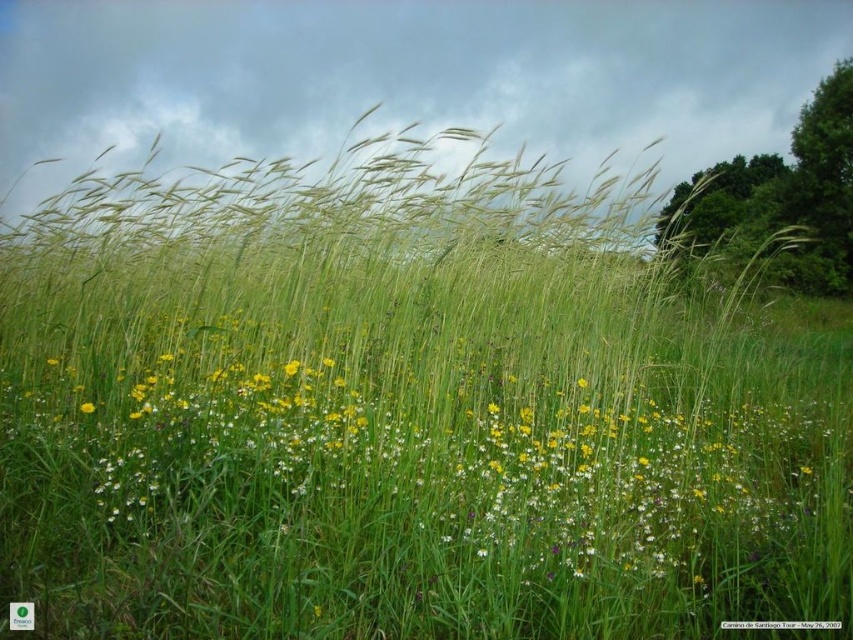
Question: Where is green grass at center located in relation to white matte flower at center in the image?

Choices:
 (A) above
 (B) below

Answer: (B)

Question: Among these points, which one is farthest from the camera?

Choices:
 (A) (53, 360)
 (B) (91, 412)
 (C) (329, 573)

Answer: (A)

Question: Which of the following is the closest to the observer?

Choices:
 (A) yellow matte flower at lower left
 (B) white matte flower at center
 (C) green grass at center

Answer: (C)

Question: Which of the following is the closest to the observer?

Choices:
 (A) white matte flower at center
 (B) yellow matte flower at lower left

Answer: (B)

Question: Can you confirm if green grass at center is bigger than white matte flower at center?

Choices:
 (A) yes
 (B) no

Answer: (A)

Question: Is green grass at center below yellow matte flower at lower left?

Choices:
 (A) no
 (B) yes

Answer: (B)